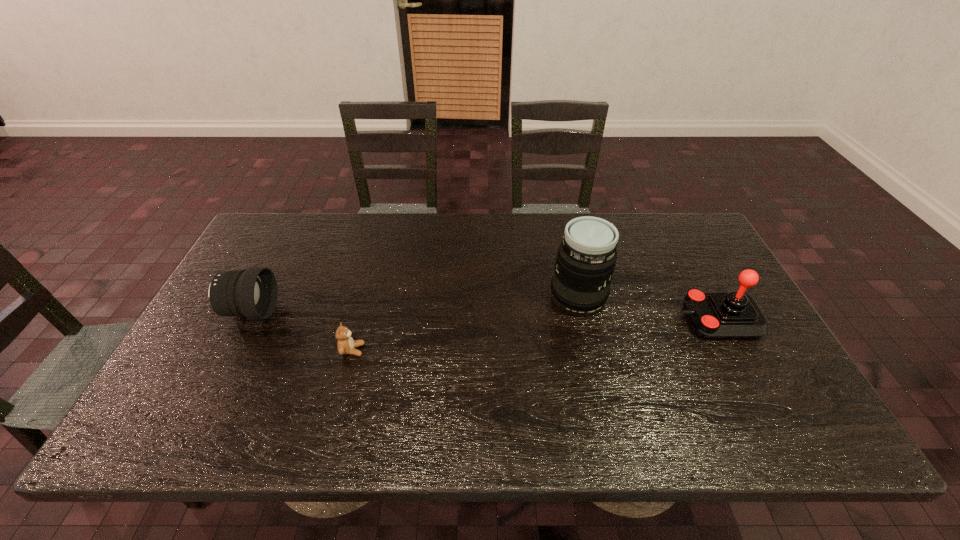
Identify which object is the second nearest to the third object from left to right. Please provide its 2D coordinates. Your answer should be formatted as a tuple, i.e. [(x, y)], where the tuple contains the x and y coordinates of a point satisfying the conditions above.

[(346, 345)]

Where is `object that stands as the closest to the shortest object`? object that stands as the closest to the shortest object is located at coordinates (252, 293).

Where is `free location that satisfies the following two spatial constraints: 1. on the front side of the right telephoto lens; 2. at the front element of the leftmost object`? The height and width of the screenshot is (540, 960). free location that satisfies the following two spatial constraints: 1. on the front side of the right telephoto lens; 2. at the front element of the leftmost object is located at coordinates (581, 312).

Locate an element on the screen. Image resolution: width=960 pixels, height=540 pixels. vacant region that satisfies the following two spatial constraints: 1. on the front side of the right telephoto lens; 2. on the front-facing side of the teddy bear is located at coordinates (589, 350).